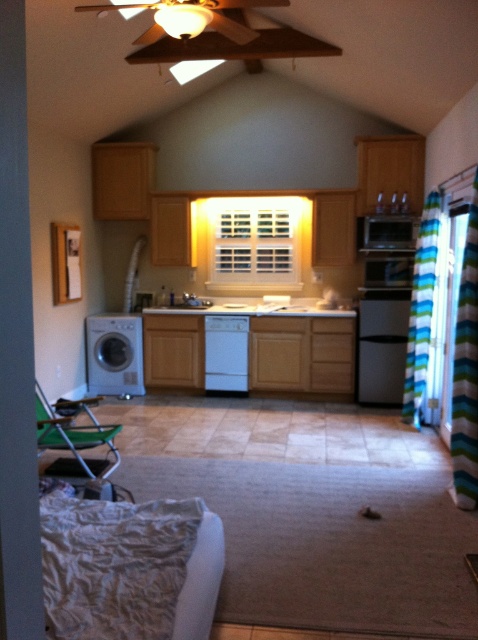
Which is above, white matte dishwasher at center or white glossy sink at center?

white glossy sink at center is higher up.

Can you confirm if white matte dishwasher at center is smaller than white glossy sink at center?

Yes, white matte dishwasher at center is smaller than white glossy sink at center.

Is point (229, 356) closer to viewer compared to point (161, 304)?

Yes, it is in front of point (161, 304).

Image resolution: width=478 pixels, height=640 pixels. I want to click on white matte dishwasher at center, so click(226, 353).

Based on the photo, is the position of white matte washer at left less distant than that of satin silver microwave at upper center?

No, it is behind satin silver microwave at upper center.

Locate an element on the screen. The height and width of the screenshot is (640, 478). white matte washer at left is located at coordinates (115, 355).

Which is behind, point (105, 336) or point (395, 216)?

The point (105, 336) is more distant.

The width and height of the screenshot is (478, 640). In order to click on white matte washer at left in this screenshot , I will do `click(115, 355)`.

Does white matte washer at left appear on the left side of white glossy sink at center?

Correct, you'll find white matte washer at left to the left of white glossy sink at center.

Is point (119, 394) more distant than point (209, 301)?

No, it is not.

Locate an element on the screen. The width and height of the screenshot is (478, 640). white matte washer at left is located at coordinates (115, 355).